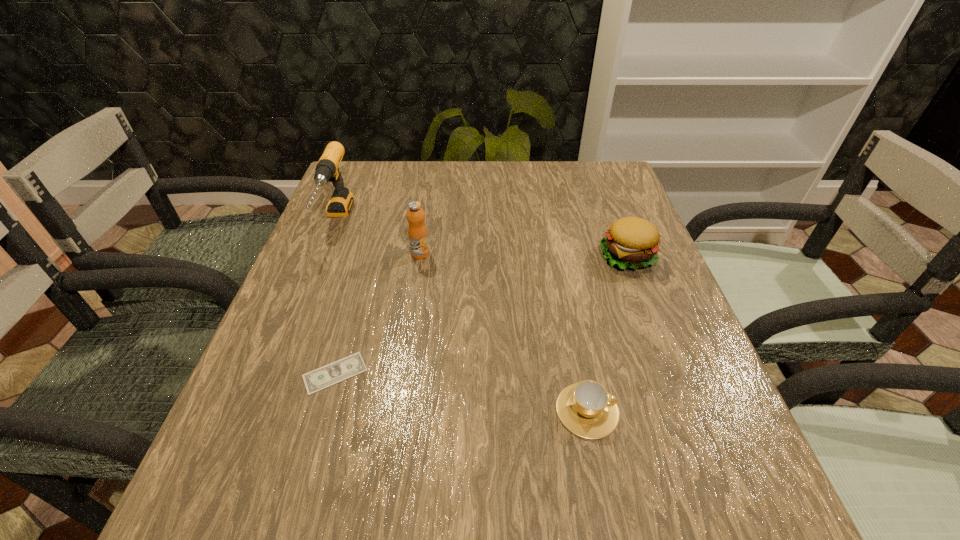
This screenshot has width=960, height=540. Identify the location of drill. (327, 170).

What are the coordinates of `orange juice` in the screenshot? It's located at (417, 231).

In order to click on the third object from right to left in this screenshot , I will do `click(417, 231)`.

Where is `the rightmost object`? the rightmost object is located at coordinates (632, 242).

Find the location of a particular element. The width and height of the screenshot is (960, 540). the third tallest object is located at coordinates (632, 242).

I want to click on the second object from right to left, so click(586, 409).

Where is `the fourth tallest object`? This screenshot has height=540, width=960. the fourth tallest object is located at coordinates click(586, 409).

The width and height of the screenshot is (960, 540). Find the location of `money`. money is located at coordinates (338, 371).

Where is `the shortest object`? The width and height of the screenshot is (960, 540). the shortest object is located at coordinates [x=338, y=371].

Image resolution: width=960 pixels, height=540 pixels. I want to click on free space located on the handle side of the drill, so click(268, 391).